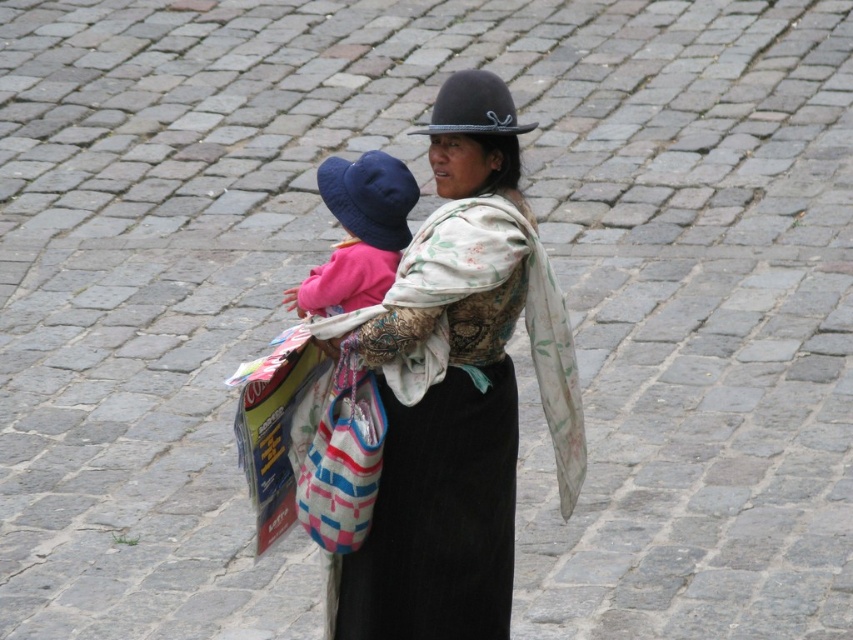
Can you confirm if matte black hat at center is shorter than navy blue fabric hat at upper center?

No, matte black hat at center is not shorter than navy blue fabric hat at upper center.

Who is higher up, matte black hat at center or navy blue fabric hat at upper center?

navy blue fabric hat at upper center is above.

Is point (479, 262) closer to viewer compared to point (379, 176)?

Yes, it is.

The image size is (853, 640). In order to click on matte black hat at center in this screenshot , I will do `click(456, 388)`.

Can you confirm if matte black hat at center is wider than matte blue fabric hat at upper center?

Yes, matte black hat at center is wider than matte blue fabric hat at upper center.

From the picture: Is matte black hat at center shorter than matte blue fabric hat at upper center?

No, matte black hat at center is not shorter than matte blue fabric hat at upper center.

Between point (466, 561) and point (390, 198), which one is positioned in front?

Positioned in front is point (390, 198).

Locate an element on the screen. Image resolution: width=853 pixels, height=640 pixels. matte black hat at center is located at coordinates click(456, 388).

Locate an element on the screen. The image size is (853, 640). matte black hat at center is located at coordinates (456, 388).

Does point (345, 596) come behind point (486, 132)?

Yes, it is behind point (486, 132).

Locate an element on the screen. matte black hat at center is located at coordinates (456, 388).